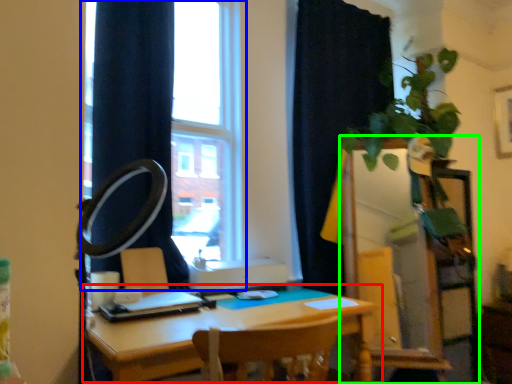
Question: Based on their relative distances, which object is farther from table (highlighted by a red box)? Choose from window (highlighted by a blue box) and dresser (highlighted by a green box).

Choices:
 (A) window
 (B) dresser

Answer: (A)